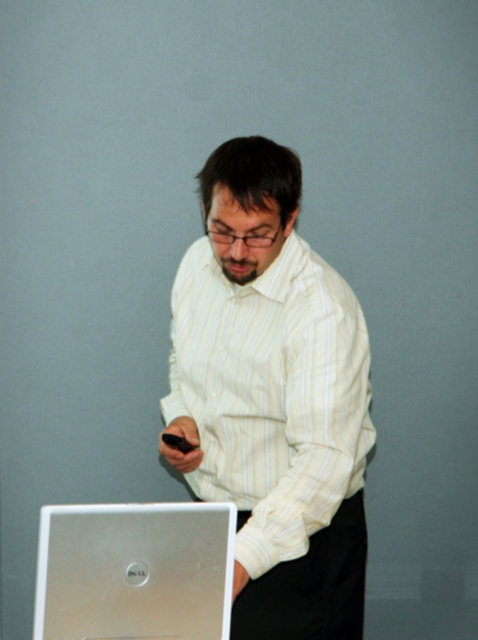
Question: Which point is farther from the camera taking this photo?

Choices:
 (A) (241, 380)
 (B) (173, 438)

Answer: (B)

Question: Which point appears closest to the camera in this image?

Choices:
 (A) (166, 440)
 (B) (270, 298)

Answer: (B)

Question: Is silver metallic laptop at lower left smaller than black matte smartphone at center?

Choices:
 (A) yes
 (B) no

Answer: (B)

Question: Does white striped shirt at center have a greater width compared to black matte smartphone at center?

Choices:
 (A) yes
 (B) no

Answer: (A)

Question: Can you confirm if white striped shirt at center is positioned to the right of black matte smartphone at center?

Choices:
 (A) no
 (B) yes

Answer: (B)

Question: Among these objects, which one is farthest from the camera?

Choices:
 (A) white striped shirt at center
 (B) silver metallic laptop at lower left

Answer: (A)